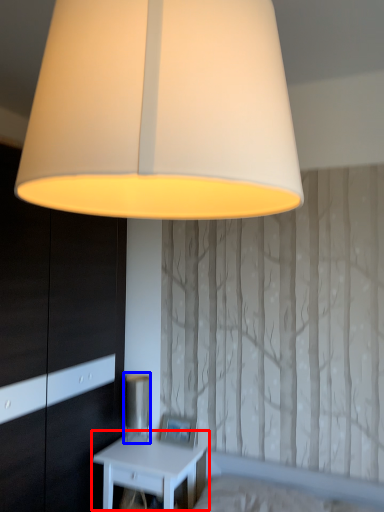
Question: Which object is further to the camera taking this photo, nightstand (highlighted by a red box) or table lamp (highlighted by a blue box)?

Choices:
 (A) nightstand
 (B) table lamp

Answer: (B)